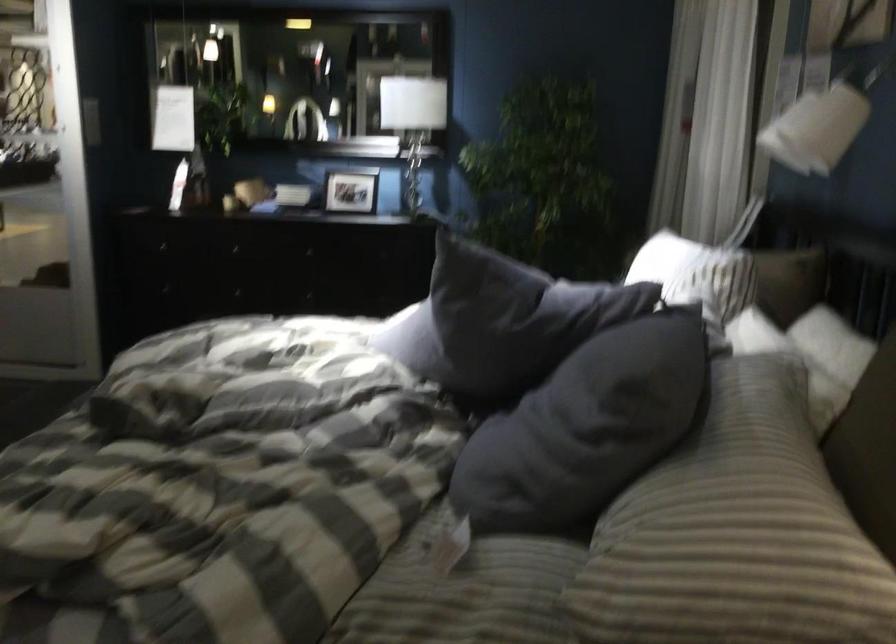
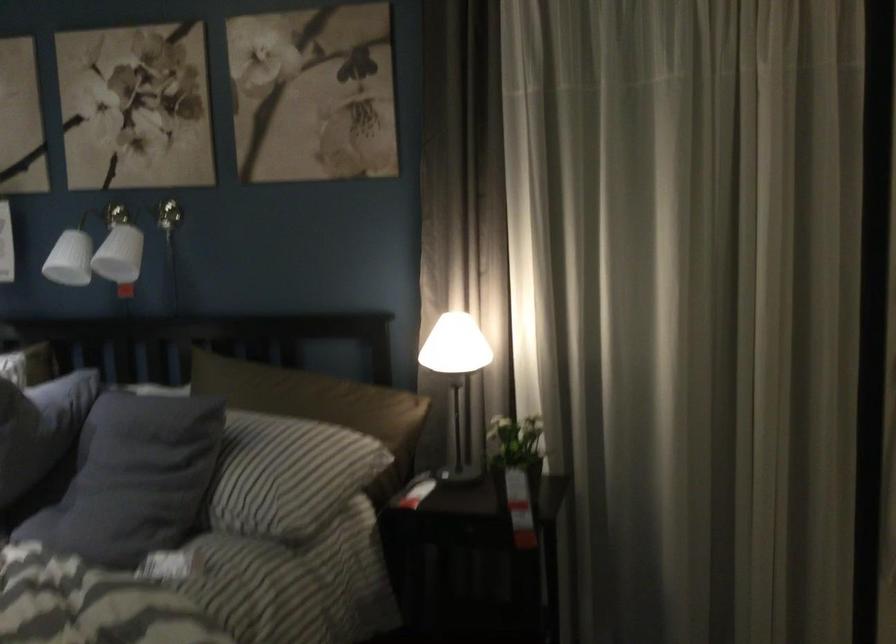
Where in the second image is the point corresponding to the point at 561,412 from the first image?

(131, 473)